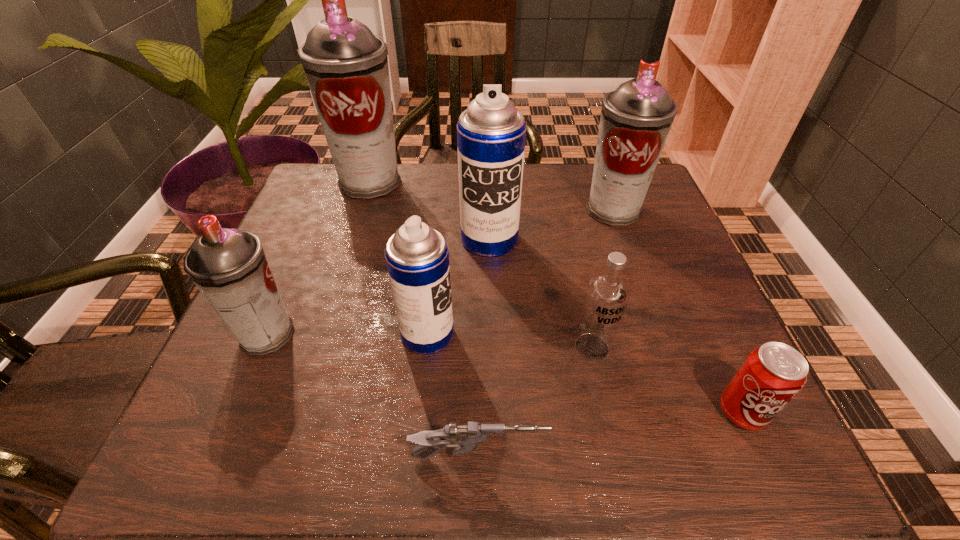
I want to click on free space in the image that satisfies the following two spatial constraints: 1. on the label side of the nearer blue aerosol can; 2. on the right side of the second shortest object, so click(x=420, y=412).

Image resolution: width=960 pixels, height=540 pixels. What are the coordinates of `blank space that satisfies the following two spatial constraints: 1. on the front label of the second shortest object; 2. on the left side of the sixth object from left to right` in the screenshot? It's located at (606, 412).